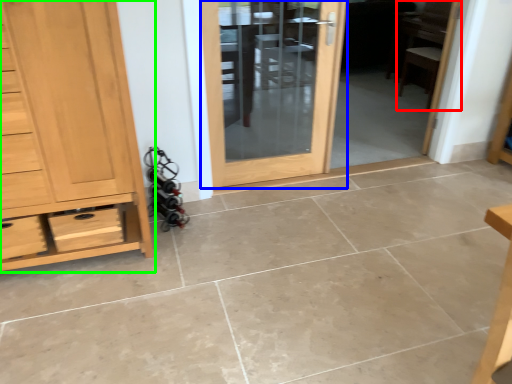
Question: Which is nearer to the chair (highlighted by a red box)? door (highlighted by a blue box) or chest of drawers (highlighted by a green box).

Choices:
 (A) door
 (B) chest of drawers

Answer: (A)